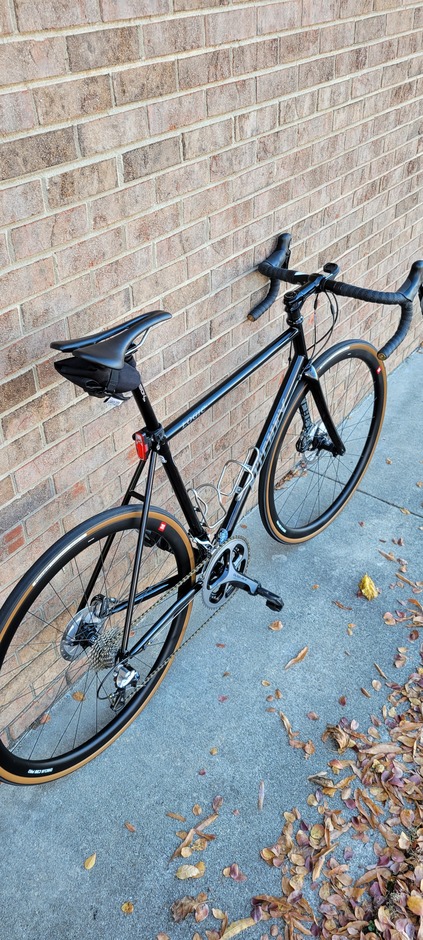
At what (x,y) coordinates should I click in order to perform the action: click on brick wall. Please return your answer as a coordinate pair (x, y). Looking at the image, I should click on (287, 91).